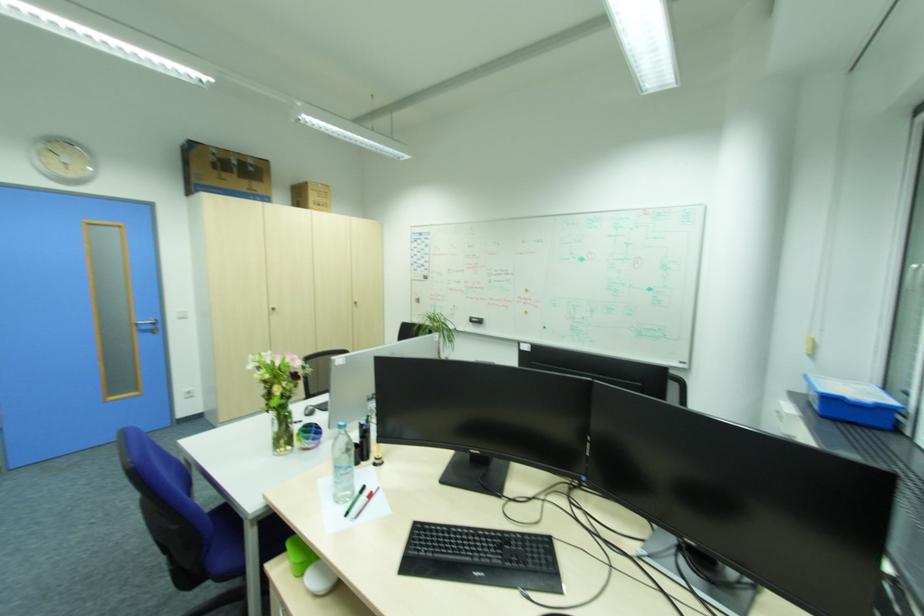
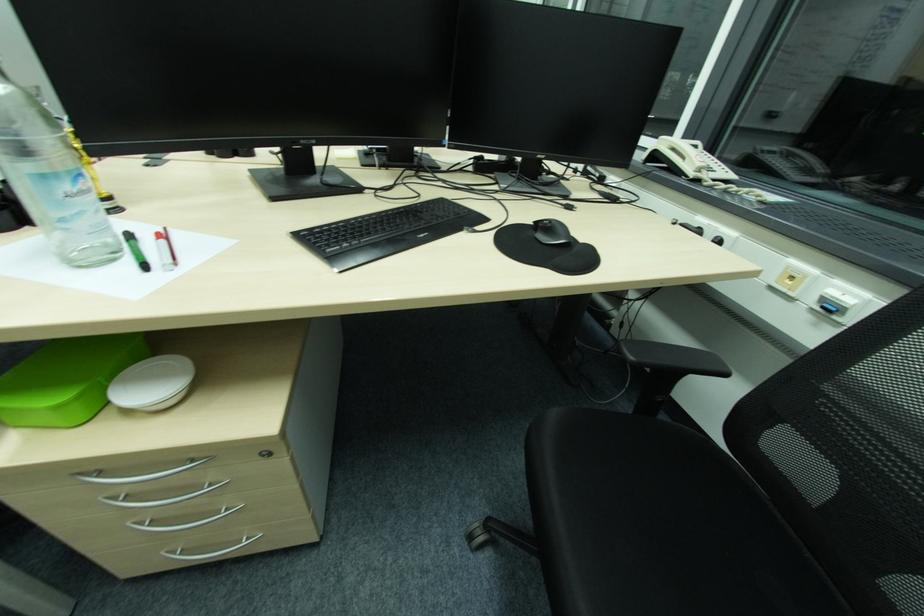
Find the pixel in the second image that matches point (351, 515) in the first image.

(149, 267)